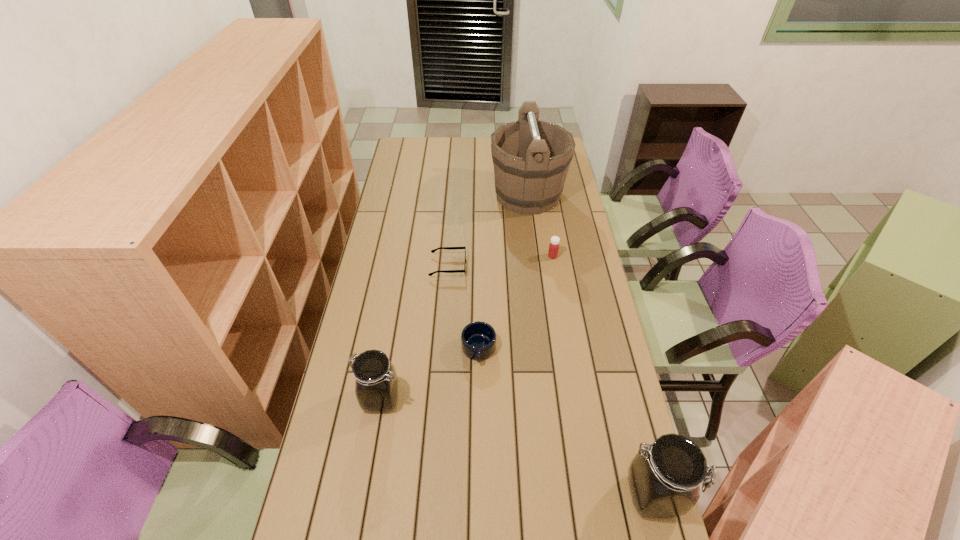
The height and width of the screenshot is (540, 960). I want to click on free spot located 0.090m on the left of the medicine, so click(x=525, y=256).

Identify the location of vacant space located with the handle on the side of the fourth farthest object. Image resolution: width=960 pixels, height=540 pixels. (478, 501).

At what (x,y) coordinates should I click in order to perform the action: click on vacant space located on the front of the bucket. Please return your answer as a coordinate pair (x, y). Looking at the image, I should click on (537, 267).

I want to click on free space located 0.350m on the arms of the shortest object, so [x=555, y=267].

Where is `object positioned at the near edge`? This screenshot has height=540, width=960. object positioned at the near edge is located at coordinates (664, 479).

The height and width of the screenshot is (540, 960). I want to click on object that is at the left edge, so click(376, 386).

I want to click on jar located at the right edge, so click(664, 479).

Locate an element on the screen. This screenshot has height=540, width=960. medicine at the right edge is located at coordinates (553, 250).

Locate an element on the screen. Image resolution: width=960 pixels, height=540 pixels. bucket that is at the right edge is located at coordinates (531, 158).

You are a GUI agent. You are given a task and a screenshot of the screen. Output one action in this format:
    pyautogui.click(x=<x>, y=<y>)
    Task: Click on the object located at the near right corner
    
    Given the screenshot: What is the action you would take?
    (664, 479)